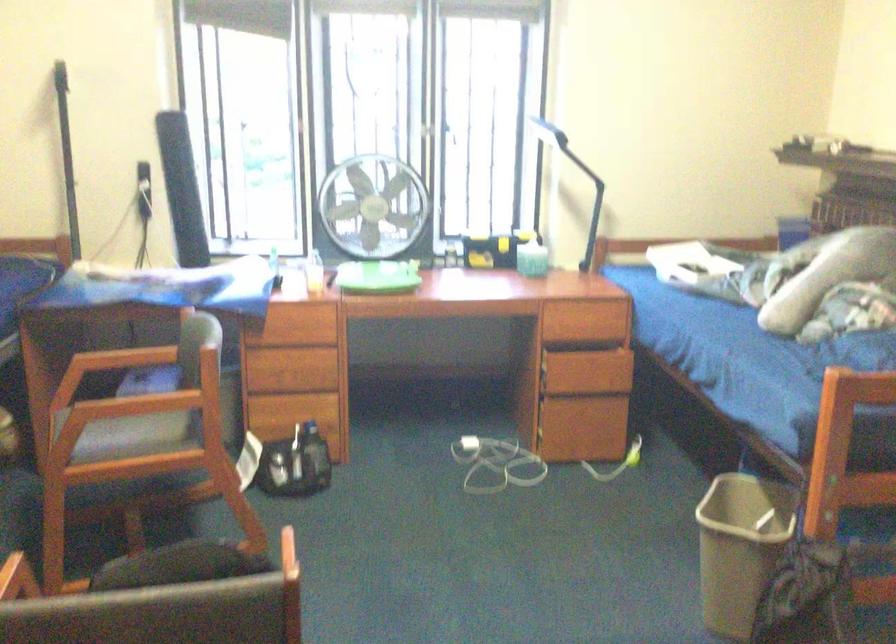
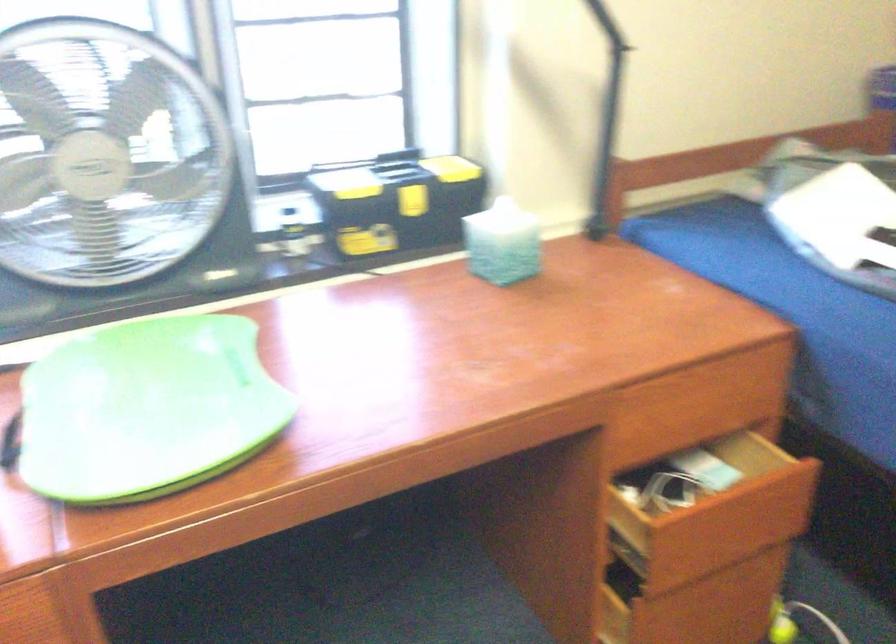
Locate, in the second image, the point that corresponds to (x=590, y=323) in the first image.

(693, 415)